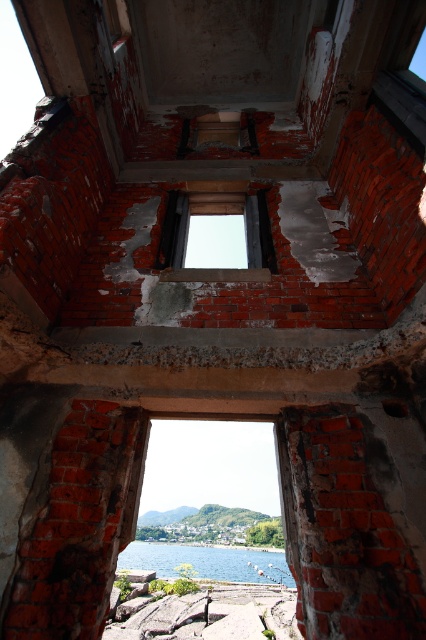
Does transparent glass window at center appear on the left side of blue water at lower center?

Indeed, transparent glass window at center is positioned on the left side of blue water at lower center.

Image resolution: width=426 pixels, height=640 pixels. What do you see at coordinates (210, 218) in the screenshot?
I see `transparent glass window at center` at bounding box center [210, 218].

You are a GUI agent. You are given a task and a screenshot of the screen. Output one action in this format:
    pyautogui.click(x=<x>, y=<y>)
    Task: Click on the transparent glass window at center
    
    Given the screenshot: What is the action you would take?
    pyautogui.click(x=210, y=218)

Between brick textured window frame at center and blue water at lower center, which one has less height?

blue water at lower center is shorter.

Does brick textured window frame at center have a smaller size compared to blue water at lower center?

No.

Does point (166, 465) lie behind point (239, 570)?

Yes, point (166, 465) is farther from viewer.

This screenshot has height=640, width=426. Find the location of `brick textured window frame at center`. brick textured window frame at center is located at coordinates (210, 468).

From the picture: Can you confirm if brick textured window frame at center is wider than transparent glass window at center?

Correct, the width of brick textured window frame at center exceeds that of transparent glass window at center.

Between point (255, 483) and point (218, 268), which one is positioned in front?

Point (218, 268) is in front.

At what (x,y) coordinates should I click in order to perform the action: click on brick textured window frame at center. Please return your answer as a coordinate pair (x, y). Image resolution: width=426 pixels, height=640 pixels. Looking at the image, I should click on (210, 468).